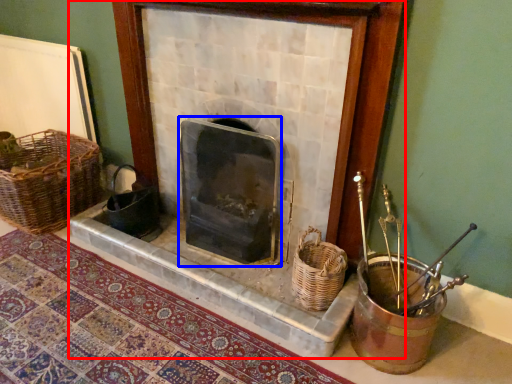
Question: Which object appears farthest to the camera in this image, fireplace (highlighted by a red box) or wood burning stove (highlighted by a blue box)?

Choices:
 (A) fireplace
 (B) wood burning stove

Answer: (B)